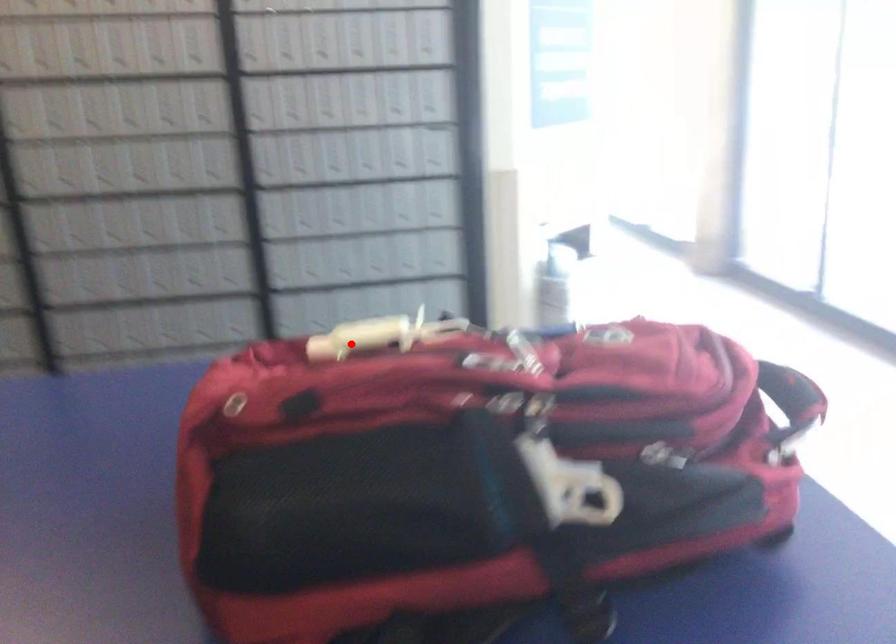
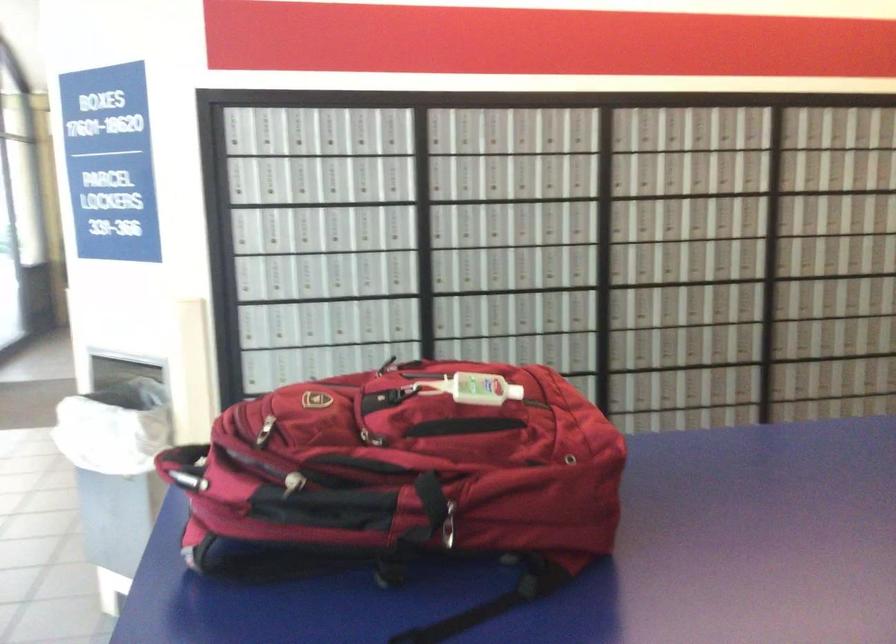
Question: I am providing you with two images of the same scene from different viewpoints. A red point is shown in image1. For the corresponding object point in image2, is it positioned nearer or farther from the camera?

Choices:
 (A) Nearer
 (B) Farther

Answer: (B)